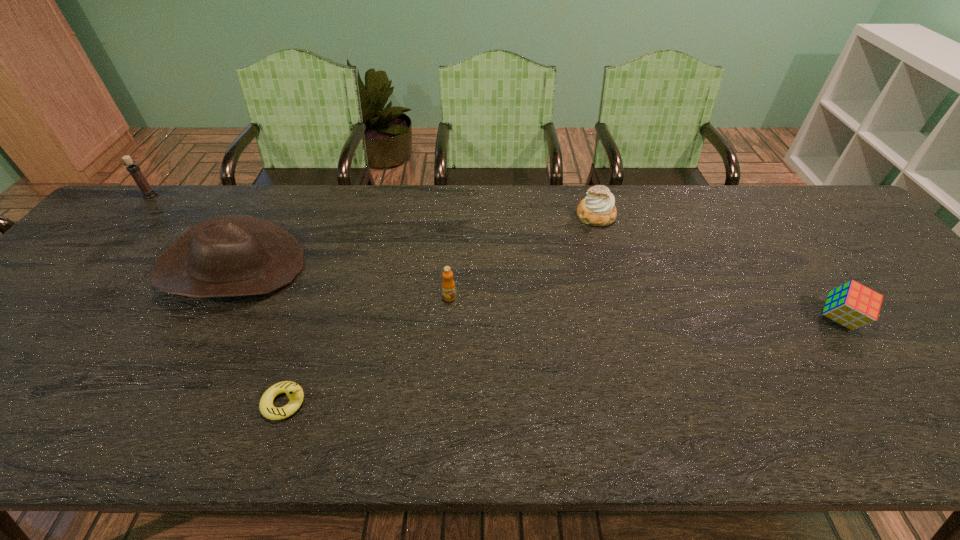
This screenshot has width=960, height=540. What are the coordinates of `object situated at the far left corner` in the screenshot? It's located at (134, 170).

The width and height of the screenshot is (960, 540). In the image, there is a desktop. In order to click on free space at the far edge in this screenshot , I will do `click(338, 199)`.

Where is `free region at the near edge of the desktop`? free region at the near edge of the desktop is located at coordinates (421, 407).

You are a GUI agent. You are given a task and a screenshot of the screen. Output one action in this format:
    pyautogui.click(x=<x>, y=<y>)
    Task: Click on the free space at the left edge of the desktop
    
    Given the screenshot: What is the action you would take?
    pyautogui.click(x=136, y=251)

This screenshot has height=540, width=960. What are the coordinates of `vacant point at the far left corner` in the screenshot? It's located at (132, 202).

The image size is (960, 540). In the image, there is a desktop. Find the location of `free region at the far right corner`. free region at the far right corner is located at coordinates (825, 211).

At what (x,y) coordinates should I click in order to perform the action: click on unoccupied position between the rightmost object and the cowboy hat. Please return your answer as a coordinate pair (x, y). Looking at the image, I should click on (537, 293).

Where is `unoccupied position between the duckling and the fifth object from right to left`? The image size is (960, 540). unoccupied position between the duckling and the fifth object from right to left is located at coordinates (259, 335).

I want to click on vacant space that is in between the farthest object and the rightmost object, so click(494, 257).

You are a GUI agent. You are given a task and a screenshot of the screen. Output one action in this format:
    pyautogui.click(x=<x>, y=<y>)
    Task: Click on the free space between the duckling and the third object from right to left
    
    Given the screenshot: What is the action you would take?
    pyautogui.click(x=367, y=350)